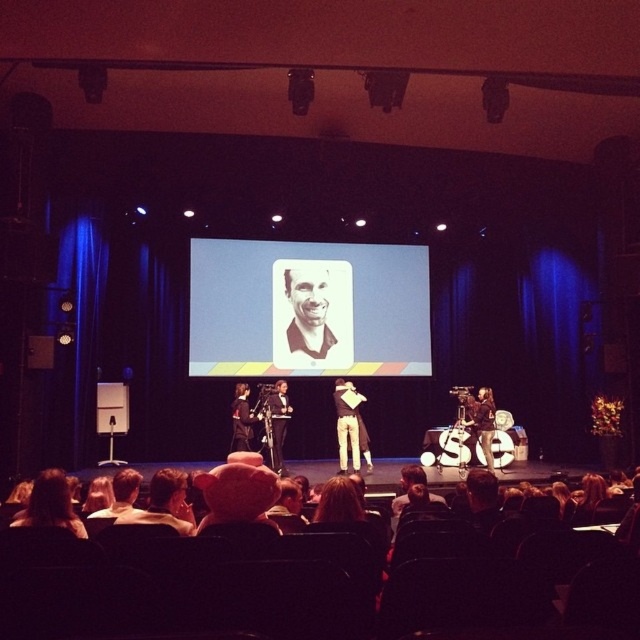
You are an event photographer who needs to capture a clear photo of the white cotton shirt at center without the white paper at center blocking it. What should you do?

The white cotton shirt at center is behind the white paper at center, so you should move your camera position to an angle where the white paper at center is not obstructing the view of the white cotton shirt at center.

From the picture: You are standing on the stage and want to move from the point at coordinates point (x=342, y=304) to the point at coordinates point (x=344, y=420). Which direction should you move?

Since point (x=342, y=304) is behind point (x=344, y=420), you should move forward to reach it.